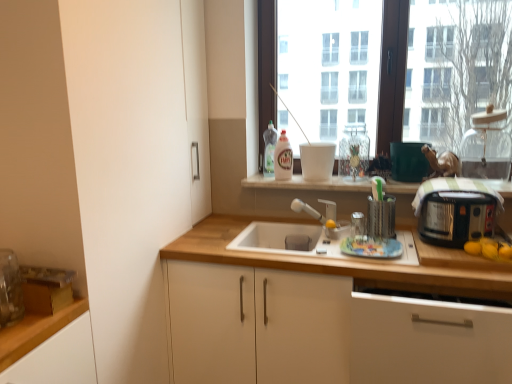
Question: Can matte silver faucet at center be found inside white matte bowl at upper center, placed as the first appliance when sorted from left to right?

Choices:
 (A) no
 (B) yes

Answer: (A)

Question: Is white matte bowl at upper center, placed as the first appliance when sorted from left to right, further to the viewer compared to matte silver faucet at center?

Choices:
 (A) no
 (B) yes

Answer: (B)

Question: From a real-world perspective, is white matte bowl at upper center, placed as the first appliance when sorted from left to right, under matte silver faucet at center?

Choices:
 (A) no
 (B) yes

Answer: (A)

Question: Is white matte bowl at upper center, which is counted as the fifth appliance, starting from the right, next to matte silver faucet at center and touching it?

Choices:
 (A) no
 (B) yes

Answer: (A)

Question: Considering the relative positions of white matte bowl at upper center, which is counted as the fifth appliance, starting from the right, and matte silver faucet at center in the image provided, is white matte bowl at upper center, which is counted as the fifth appliance, starting from the right, to the right of matte silver faucet at center from the viewer's perspective?

Choices:
 (A) no
 (B) yes

Answer: (B)

Question: From the image's perspective, relative to transparent glass window at center, is translucent plastic bottle at upper center, the second bottle from the front, above or below?

Choices:
 (A) above
 (B) below

Answer: (B)

Question: In terms of size, does translucent plastic bottle at upper center, the second bottle from the front, appear bigger or smaller than transparent glass window at center?

Choices:
 (A) big
 (B) small

Answer: (B)

Question: Looking at their shapes, would you say translucent plastic bottle at upper center, the second bottle from the front, is wider or thinner than transparent glass window at center?

Choices:
 (A) thin
 (B) wide

Answer: (B)

Question: Considering the positions of translucent plastic bottle at upper center, arranged as the 1th bottle when viewed from the back, and transparent glass window at center in the image, is translucent plastic bottle at upper center, arranged as the 1th bottle when viewed from the back, taller or shorter than transparent glass window at center?

Choices:
 (A) tall
 (B) short

Answer: (B)

Question: From a real-world perspective, is transparent glass window at center above or below white matte bowl at upper center, which is counted as the fifth appliance, starting from the right?

Choices:
 (A) below
 (B) above

Answer: (B)

Question: Is transparent glass window at center taller or shorter than white matte bowl at upper center, which is counted as the fifth appliance, starting from the right?

Choices:
 (A) tall
 (B) short

Answer: (A)

Question: Considering the positions of point (453, 9) and point (305, 162), is point (453, 9) closer or farther from the camera than point (305, 162)?

Choices:
 (A) farther
 (B) closer

Answer: (B)

Question: Is transparent glass window at center bigger or smaller than white matte bowl at upper center, placed as the first appliance when sorted from left to right?

Choices:
 (A) small
 (B) big

Answer: (B)

Question: From the image's perspective, relative to clear plastic utensil holder at upper right, arranged as the second appliance when viewed from the left, is white matte countertop at center above or below?

Choices:
 (A) below
 (B) above

Answer: (B)

Question: In terms of height, does white matte countertop at center look taller or shorter compared to clear plastic utensil holder at upper right, arranged as the second appliance when viewed from the left?

Choices:
 (A) short
 (B) tall

Answer: (A)